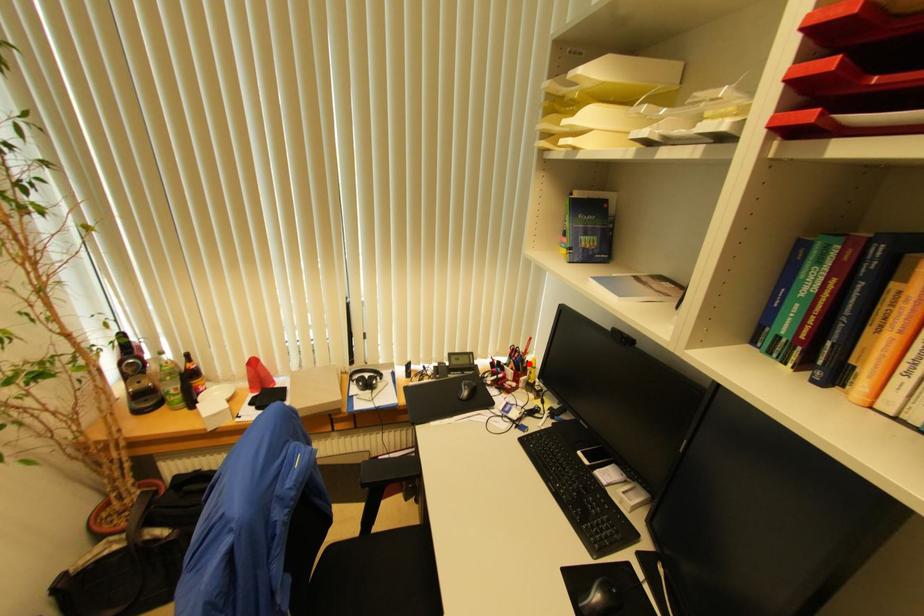
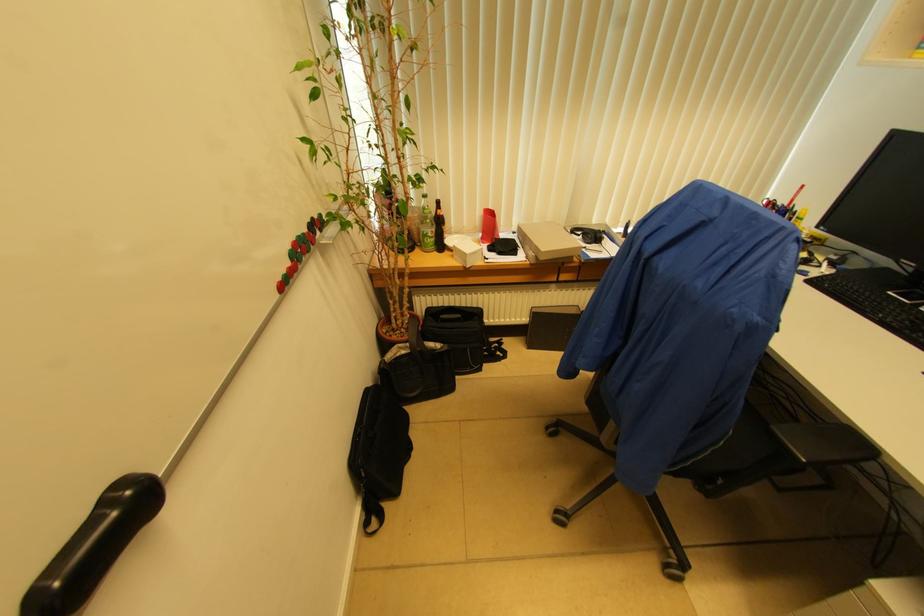
The point at the highlighted location is marked in the first image. Where is the corresponding point in the second image?

(796, 215)